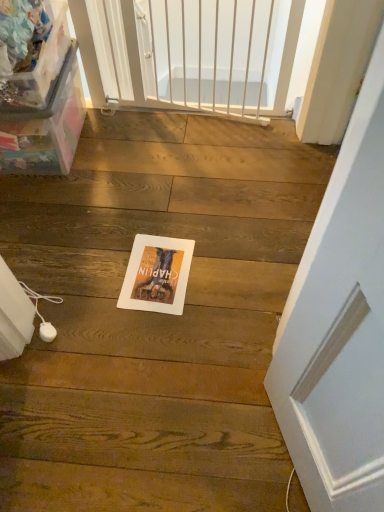
Question: Is white metal gate at upper center placed right next to transparent plastic box at left?

Choices:
 (A) yes
 (B) no

Answer: (B)

Question: From a real-world perspective, is white metal gate at upper center located higher than transparent plastic box at left?

Choices:
 (A) no
 (B) yes

Answer: (A)

Question: Considering the relative positions of white metal gate at upper center and transparent plastic box at left in the image provided, is white metal gate at upper center behind transparent plastic box at left?

Choices:
 (A) yes
 (B) no

Answer: (A)

Question: From the image's perspective, does white metal gate at upper center appear lower than transparent plastic box at left?

Choices:
 (A) no
 (B) yes

Answer: (A)

Question: Can you confirm if white metal gate at upper center is positioned to the right of transparent plastic box at left?

Choices:
 (A) no
 (B) yes

Answer: (B)

Question: Is transparent plastic box at left wider or thinner than matte paper postcard at center?

Choices:
 (A) wide
 (B) thin

Answer: (A)

Question: Is point (13, 118) closer or farther from the camera than point (147, 268)?

Choices:
 (A) closer
 (B) farther

Answer: (B)

Question: Considering the positions of transparent plastic box at left and matte paper postcard at center in the image, is transparent plastic box at left taller or shorter than matte paper postcard at center?

Choices:
 (A) tall
 (B) short

Answer: (A)

Question: Considering their positions, is transparent plastic box at left located in front of or behind matte paper postcard at center?

Choices:
 (A) front
 (B) behind

Answer: (A)

Question: Is matte paper postcard at center bigger or smaller than transparent plastic box at left?

Choices:
 (A) big
 (B) small

Answer: (B)

Question: Is point (152, 303) positioned closer to the camera than point (39, 166)?

Choices:
 (A) farther
 (B) closer

Answer: (B)

Question: Which is correct: matte paper postcard at center is inside transparent plastic box at left, or outside of it?

Choices:
 (A) outside
 (B) inside

Answer: (A)

Question: From a real-world perspective, relative to transparent plastic box at left, is matte paper postcard at center vertically above or below?

Choices:
 (A) below
 (B) above

Answer: (A)

Question: Considering the positions of white metal gate at upper center and matte paper postcard at center in the image, is white metal gate at upper center bigger or smaller than matte paper postcard at center?

Choices:
 (A) small
 (B) big

Answer: (B)

Question: Is point (228, 20) positioned closer to the camera than point (135, 243)?

Choices:
 (A) closer
 (B) farther

Answer: (B)